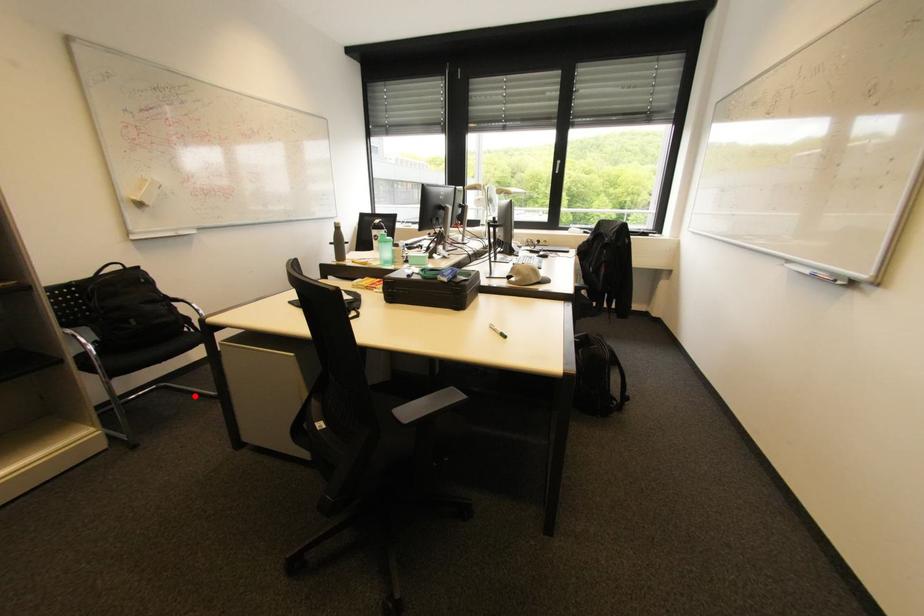
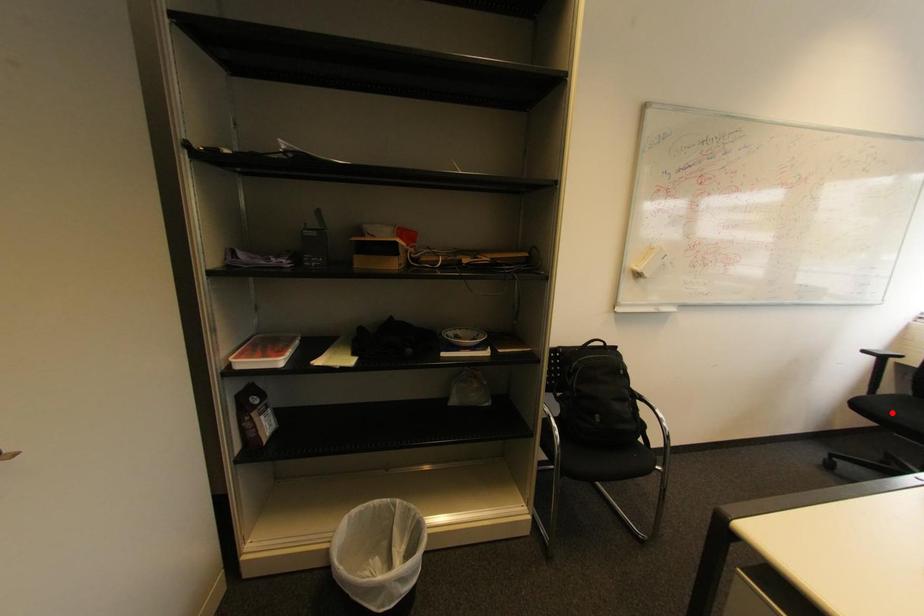
I am providing you with two images of the same scene from different viewpoints. A red point is marked on the first image and another point is marked on the second image. Are the points marked in image1 and image2 representing the same 3D position?

No